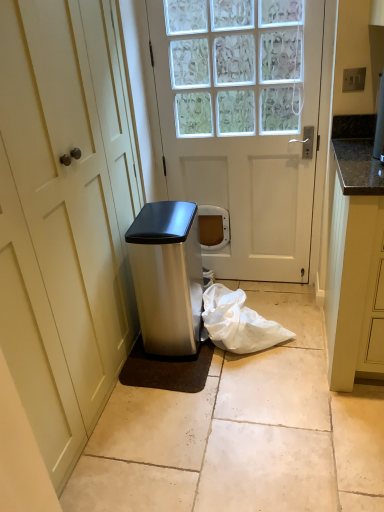
Question: Is white matte door at center, positioned as the second door in left-to-right order, oriented towards granite countertop at right?

Choices:
 (A) yes
 (B) no

Answer: (B)

Question: Could granite countertop at right be considered to be inside white matte door at center, which is counted as the 1th door, starting from the right?

Choices:
 (A) yes
 (B) no

Answer: (B)

Question: Is white matte door at center, positioned as the second door in left-to-right order, wider than granite countertop at right?

Choices:
 (A) no
 (B) yes

Answer: (A)

Question: Considering the relative sizes of white matte door at center, which is counted as the 1th door, starting from the right, and granite countertop at right in the image provided, is white matte door at center, which is counted as the 1th door, starting from the right, bigger than granite countertop at right?

Choices:
 (A) no
 (B) yes

Answer: (A)

Question: Is white matte door at center, positioned as the second door in left-to-right order, looking in the opposite direction of granite countertop at right?

Choices:
 (A) yes
 (B) no

Answer: (B)

Question: Considering the relative sizes of white matte door at center, which is counted as the 1th door, starting from the right, and granite countertop at right in the image provided, is white matte door at center, which is counted as the 1th door, starting from the right, thinner than granite countertop at right?

Choices:
 (A) yes
 (B) no

Answer: (A)

Question: Is white matte door at center, which is counted as the 1th door, starting from the right, positioned far away from satin silver trash can at lower left?

Choices:
 (A) no
 (B) yes

Answer: (A)

Question: From the image's perspective, would you say white matte door at center, positioned as the second door in left-to-right order, is shown under satin silver trash can at lower left?

Choices:
 (A) yes
 (B) no

Answer: (B)

Question: Is white matte door at center, positioned as the second door in left-to-right order, facing towards satin silver trash can at lower left?

Choices:
 (A) yes
 (B) no

Answer: (A)

Question: Is satin silver trash can at lower left completely or partially inside white matte door at center, which is counted as the 1th door, starting from the right?

Choices:
 (A) yes
 (B) no

Answer: (B)

Question: Is white matte door at center, which is counted as the 1th door, starting from the right, not within satin silver trash can at lower left?

Choices:
 (A) yes
 (B) no

Answer: (A)

Question: Does white matte door at center, positioned as the second door in left-to-right order, have a smaller size compared to satin silver trash can at lower left?

Choices:
 (A) no
 (B) yes

Answer: (A)

Question: Is satin silver trash can at lower left at the back of white matte door at center, the 2th door from the right?

Choices:
 (A) no
 (B) yes

Answer: (B)